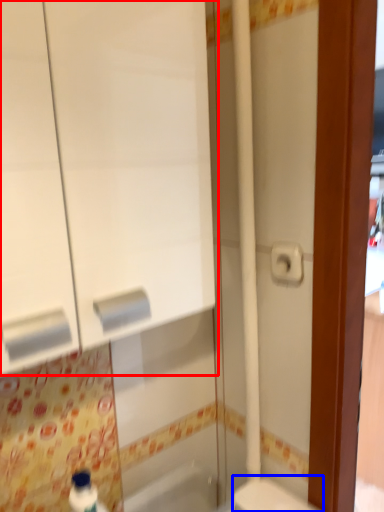
Question: Which of the following is the farthest to the observer, medicine cabinet (highlighted by a red box) or toilet (highlighted by a blue box)?

Choices:
 (A) medicine cabinet
 (B) toilet

Answer: (B)